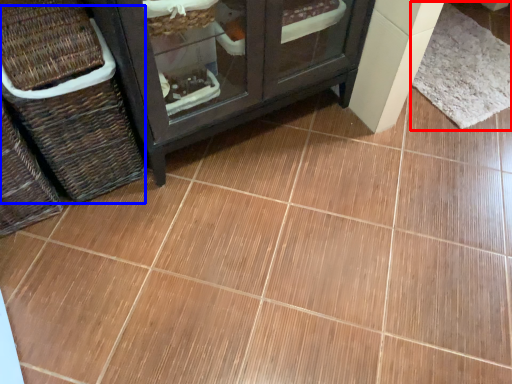
Question: Which of the following is the farthest to the observer, mat (highlighted by a red box) or basket (highlighted by a blue box)?

Choices:
 (A) mat
 (B) basket

Answer: (A)